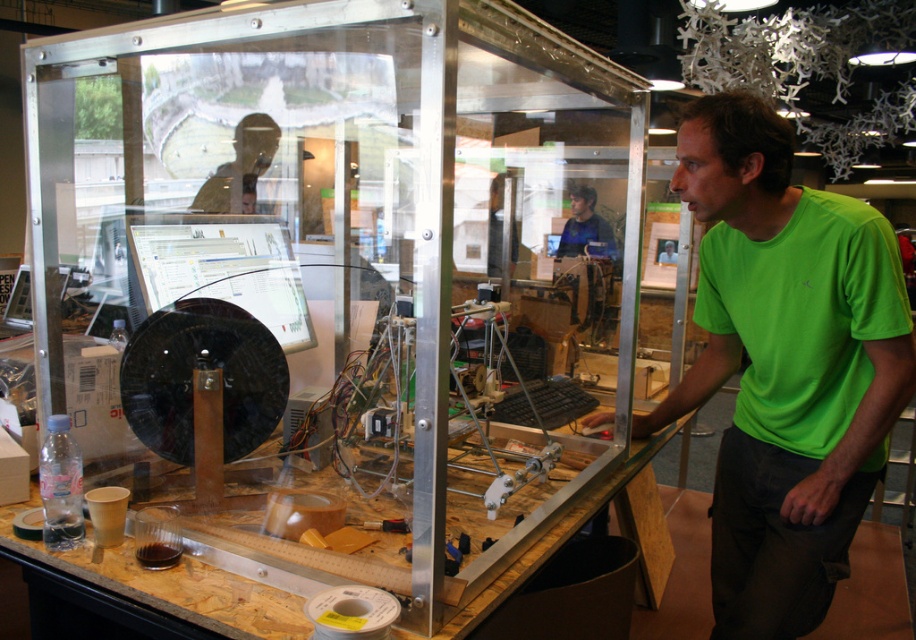
Is green matte shirt at center positioned behind blue fabric shirt at center?

No, green matte shirt at center is in front of blue fabric shirt at center.

In the scene shown: Does green matte shirt at center lie in front of blue fabric shirt at center?

That is True.

Which is behind, point (759, 404) or point (565, 227)?

The point (565, 227) is more distant.

Find the location of a particular element. The width and height of the screenshot is (916, 640). green matte shirt at center is located at coordinates (784, 364).

Is transparent acrylic glass box at center closer to camera compared to blue fabric shirt at center?

Yes, transparent acrylic glass box at center is closer to the viewer.

Who is more forward, (640, 220) or (558, 246)?

Point (640, 220) is more forward.

What are the coordinates of `transparent acrylic glass box at center` in the screenshot? It's located at (340, 291).

Looking at this image, which of these two, green matte shirt at center or matte black laptop at upper left, stands taller?

Standing taller between the two is green matte shirt at center.

Which is below, green matte shirt at center or matte black laptop at upper left?

green matte shirt at center is lower down.

This screenshot has height=640, width=916. In order to click on green matte shirt at center in this screenshot , I will do `click(784, 364)`.